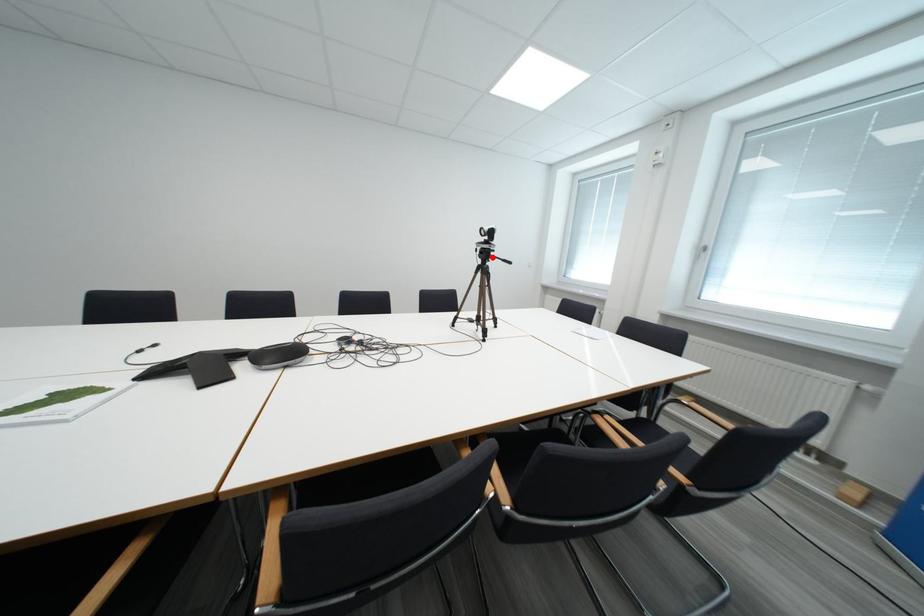
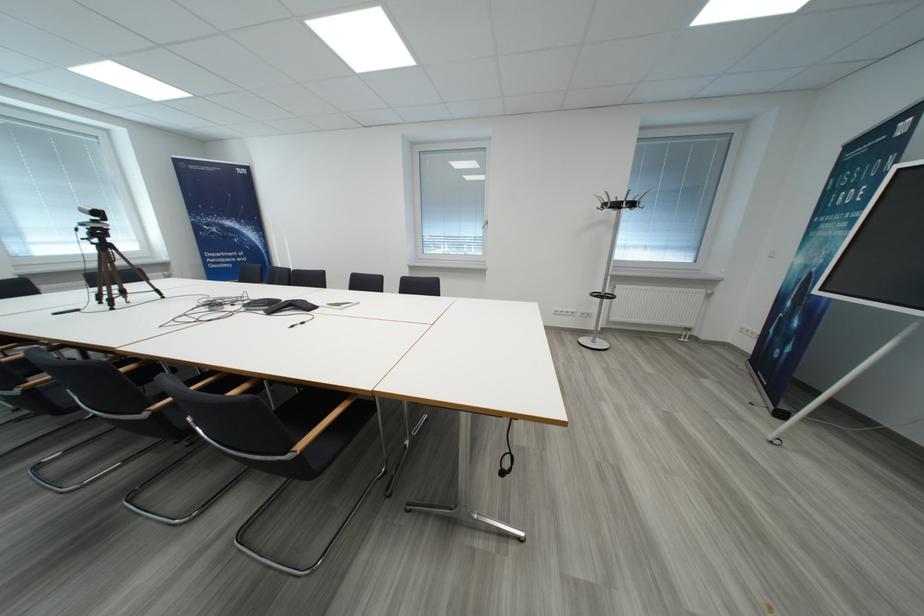
Question: I am providing you with two images of the same scene from different viewpoints. A red point is shown in image1. For the corresponding object point in image2, is it positioned nearer or farther from the camera?

Choices:
 (A) Nearer
 (B) Farther

Answer: (B)